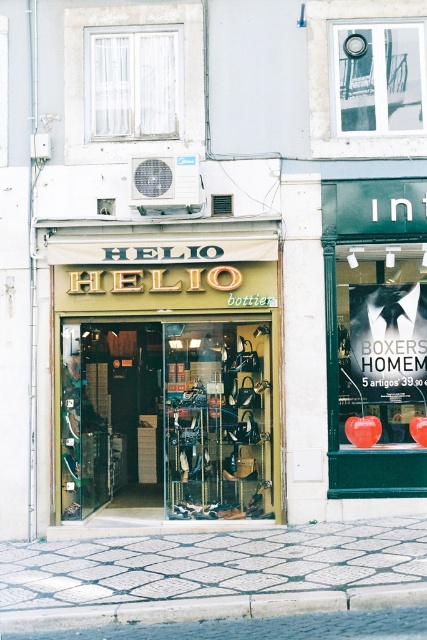
Does point (414, 353) lie behind point (76, 620)?

Yes, it is behind point (76, 620).

Which is below, matte black poster at center right or concrete at lower center?

concrete at lower center is below.

Is point (356, 300) positioned behind point (8, 618)?

Yes.

Locate an element on the screen. This screenshot has height=640, width=427. matte black poster at center right is located at coordinates (382, 344).

In the scene shown: Between matte gold signboard at center and white sheer curtain at upper left, which one has less height?

white sheer curtain at upper left

Can you confirm if matte gold signboard at center is thinner than white sheer curtain at upper left?

In fact, matte gold signboard at center might be wider than white sheer curtain at upper left.

Between point (169, 264) and point (172, 97), which one is positioned in front?

Point (169, 264) is more forward.

Find the location of a particular element. matte gold signboard at center is located at coordinates (170, 381).

Does matte gold signboard at center have a larger size compared to matte black poster at center right?

Correct, matte gold signboard at center is larger in size than matte black poster at center right.

The image size is (427, 640). Describe the element at coordinates (170, 381) in the screenshot. I see `matte gold signboard at center` at that location.

Is point (190, 353) positioned in front of point (360, 388)?

No, (190, 353) is further to viewer.

This screenshot has width=427, height=640. Find the location of `matte gold signboard at center`. matte gold signboard at center is located at coordinates click(x=170, y=381).